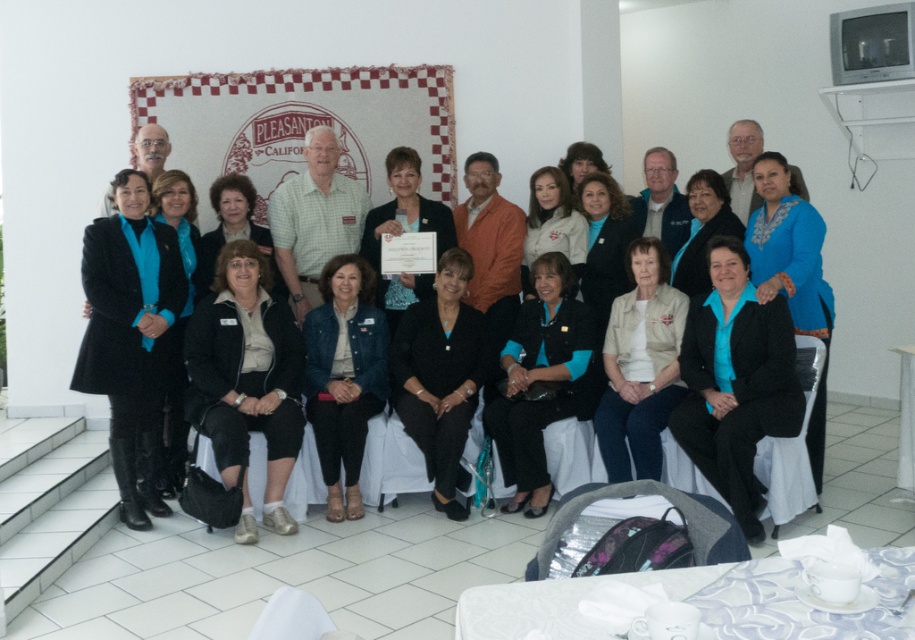
Question: Does matte black blazer at lower center appear over matte black jacket at center?

Choices:
 (A) no
 (B) yes

Answer: (B)

Question: Is matte black blazer at lower center wider than white glossy table at lower right?

Choices:
 (A) yes
 (B) no

Answer: (A)

Question: Is the position of white porcelain cup at lower right less distant than that of beige fabric jacket at center?

Choices:
 (A) yes
 (B) no

Answer: (A)

Question: Among these objects, which one is farthest from the camera?

Choices:
 (A) matte black jacket at center
 (B) teal fabric jacket at center
 (C) beige fabric jacket at center
 (D) black textured blazer at center

Answer: (D)

Question: Estimate the real-world distances between objects in this image. Which object is farther from the teal fabric jacket at center?

Choices:
 (A) white glossy table at lower right
 (B) black textured blazer at center
 (C) beige fabric jacket at center
 (D) matte black coat at left

Answer: (D)

Question: Estimate the real-world distances between objects in this image. Which object is closer to the teal fabric jacket at center?

Choices:
 (A) white glossy table at lower right
 (B) denim jacket at center

Answer: (B)